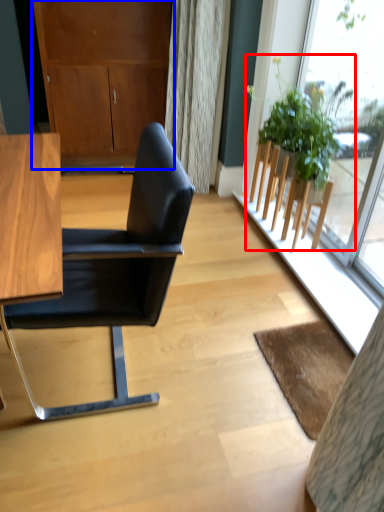
Question: Which of the following is the farthest to the observer, houseplant (highlighted by a red box) or dresser (highlighted by a blue box)?

Choices:
 (A) houseplant
 (B) dresser

Answer: (B)